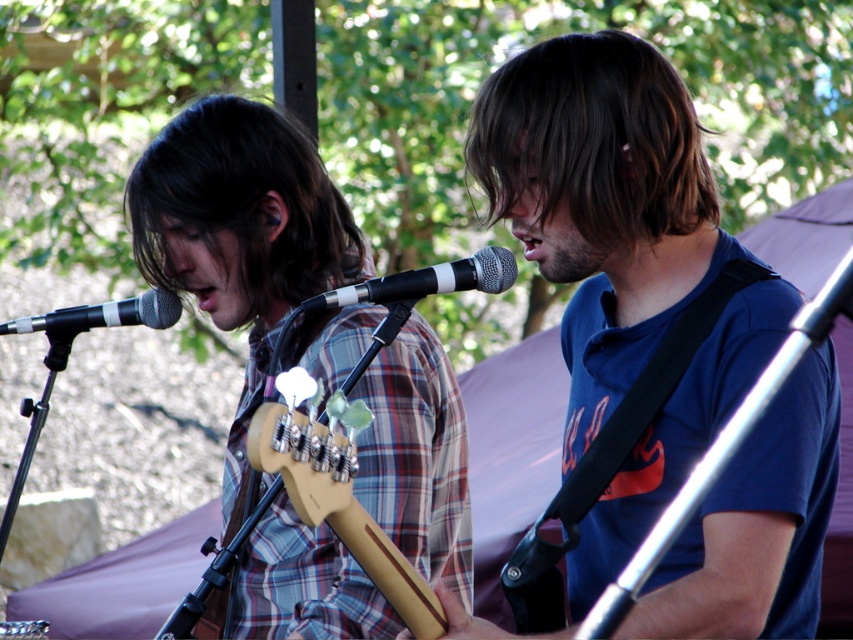
You are a photographer at the music event and want to capture a closeup shot of the performer. You need to decide which object to focus on first between the dark brown straight hair at upper center and the black matte microphone at center. Which object should you focus on first and why?

The dark brown straight hair at upper center is bigger than the black matte microphone at center, so you should focus on the dark brown straight hair at upper center first because it is larger and more prominent in the frame.

You are a photographer at the music event and want to capture a clear shot of both the dark brown straight hair at upper center and the black matte microphone at center. Which object should you focus on first to ensure both are in focus?

The dark brown straight hair at upper center is in front of the black matte microphone at center, so you should focus on the dark brown straight hair at upper center first to ensure both are in focus.

You are a sound technician at the music festival and need to adjust the microphone to ensure the performer can sing comfortably. The microphone has a recommended distance of 6 inches for optimal sound quality. Based on the current position of the matte black microphone at left relative to the brown matte hair at center, is the microphone too close, too far, or at the ideal distance?

The brown matte hair at center is 7.44 inches away from the matte black microphone at left. Since the recommended distance is 6 inches, the microphone is slightly too far from the performer. Adjust it closer to achieve optimal sound quality.